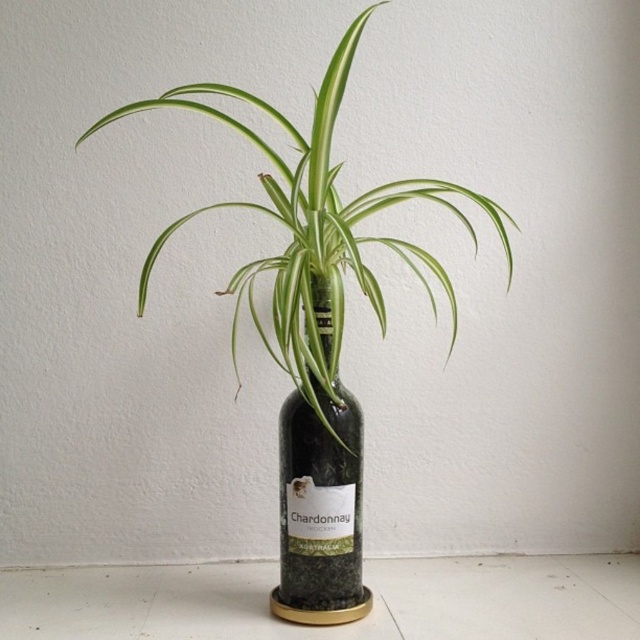
You are standing in front of a wine bottle planter. There is a point at coordinates (314, 230). What object is located at that point?

The point at coordinates (314, 230) corresponds to the green leafy plant at center.

Looking at this image, you are standing in front of the wine bottle planter and want to touch both points. Which point, point (326, 228) or point (298, 481), will you reach first?

Point (326, 228) is closer to the viewer than point (298, 481), so you will reach point (326, 228) first.

You are standing in front of the image and want to know which object is closer to you between the green leafy plant at center and the green glass bottle at center. Can you tell me?

The green leafy plant at center is in front of the green glass bottle at center, so the green leafy plant at center is closer to you.